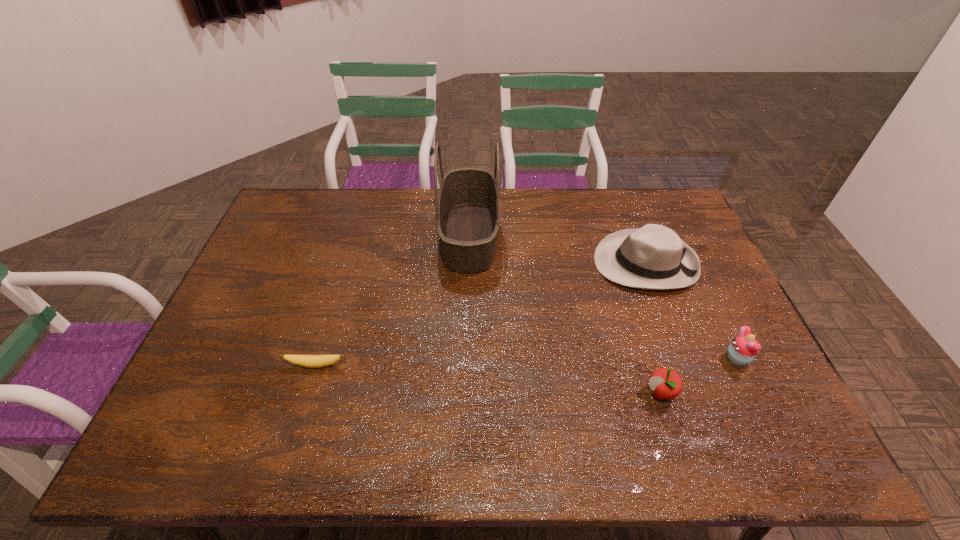
Identify the location of basket. (467, 206).

Find the location of a particular element. the tallest object is located at coordinates (467, 206).

I want to click on fedora, so click(x=653, y=257).

Where is `cupcake`? cupcake is located at coordinates (742, 350).

Find the location of a particular element. the nearest object is located at coordinates (666, 383).

I want to click on the leftmost object, so click(x=309, y=361).

In order to click on banana in this screenshot , I will do `click(309, 361)`.

I want to click on vacant space located on the front of the tallest object, so click(468, 296).

At what (x,y) coordinates should I click in order to perform the action: click on vacant space located 0.290m on the front-facing side of the fedora. Please return your answer as a coordinate pair (x, y). The width and height of the screenshot is (960, 540). Looking at the image, I should click on (503, 263).

The width and height of the screenshot is (960, 540). Identify the location of vacant area situated 0.120m on the front-facing side of the fedora. (557, 263).